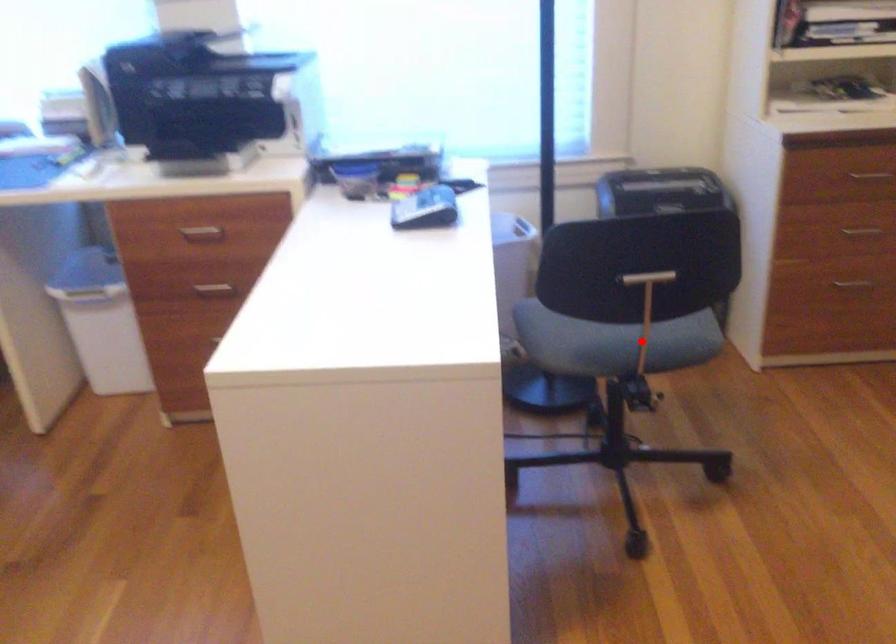
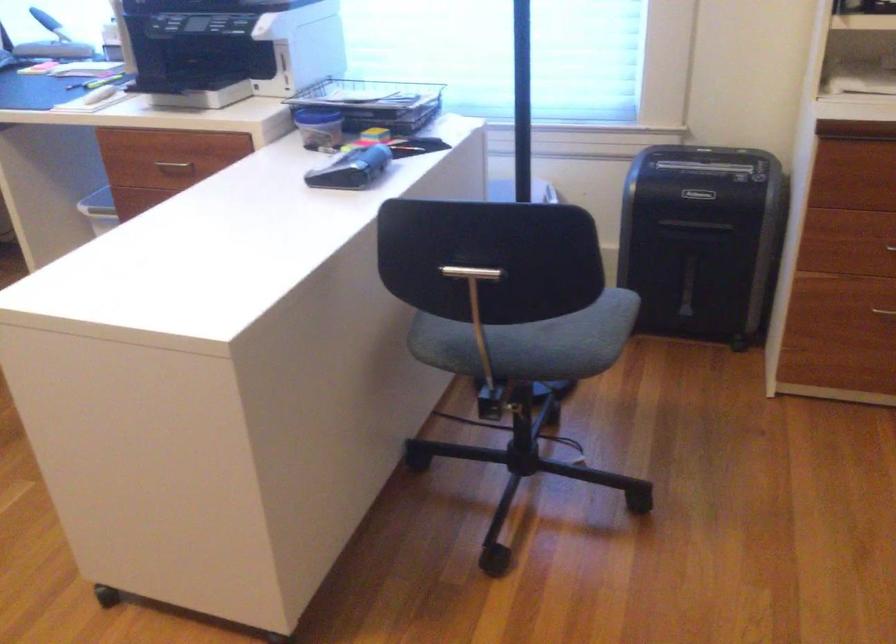
Question: A red point is marked in image1. In image2, is the corresponding 3D point closer to the camera or farther? Reply with the corresponding letter.

Choices:
 (A) The corresponding 3D point is closer.
 (B) The corresponding 3D point is farther.

Answer: (A)